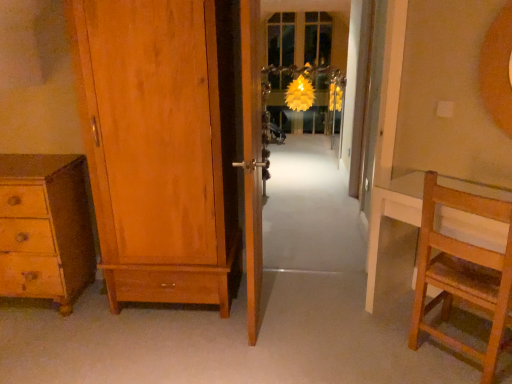
Question: Is matte wood wardrobe at left, which is the first door in left-to-right order, placed right next to translucent glass screen door at center?

Choices:
 (A) yes
 (B) no

Answer: (B)

Question: From a real-world perspective, is matte wood wardrobe at left, which appears as the 2th door when viewed from the right, below translucent glass screen door at center?

Choices:
 (A) no
 (B) yes

Answer: (A)

Question: From the image's perspective, is matte wood wardrobe at left, which is the first door in left-to-right order, above translucent glass screen door at center?

Choices:
 (A) no
 (B) yes

Answer: (A)

Question: Can you confirm if matte wood wardrobe at left, which appears as the 2th door when viewed from the right, is thinner than translucent glass screen door at center?

Choices:
 (A) yes
 (B) no

Answer: (B)

Question: Considering the relative sizes of matte wood wardrobe at left, which appears as the 2th door when viewed from the right, and translucent glass screen door at center in the image provided, is matte wood wardrobe at left, which appears as the 2th door when viewed from the right, shorter than translucent glass screen door at center?

Choices:
 (A) yes
 (B) no

Answer: (A)

Question: Is matte wood wardrobe at left, which is the first door in left-to-right order, bigger than translucent glass screen door at center?

Choices:
 (A) no
 (B) yes

Answer: (B)

Question: Does wooden door at center, the 1th door in the right-to-left sequence, have a lesser width compared to translucent glass screen door at center?

Choices:
 (A) yes
 (B) no

Answer: (B)

Question: Is wooden door at center, the 1th door in the right-to-left sequence, bigger than translucent glass screen door at center?

Choices:
 (A) no
 (B) yes

Answer: (B)

Question: Does wooden door at center, acting as the second door starting from the left, have a greater height compared to translucent glass screen door at center?

Choices:
 (A) yes
 (B) no

Answer: (B)

Question: Is wooden door at center, the 1th door in the right-to-left sequence, facing away from translucent glass screen door at center?

Choices:
 (A) yes
 (B) no

Answer: (B)

Question: From a real-world perspective, does wooden door at center, acting as the second door starting from the left, sit lower than translucent glass screen door at center?

Choices:
 (A) no
 (B) yes

Answer: (A)

Question: Is wooden door at center, the 1th door in the right-to-left sequence, outside of translucent glass screen door at center?

Choices:
 (A) yes
 (B) no

Answer: (A)

Question: From the image's perspective, would you say translucent glass screen door at center is shown under white carpet at center, the first path from the top?

Choices:
 (A) no
 (B) yes

Answer: (B)